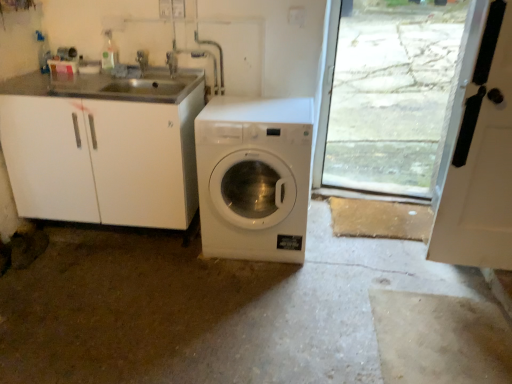
Find the location of a particular element. The height and width of the screenshot is (384, 512). vacant region to the left of brushed metal faucet at upper center, the second faucet in the right-to-left sequence is located at coordinates (128, 80).